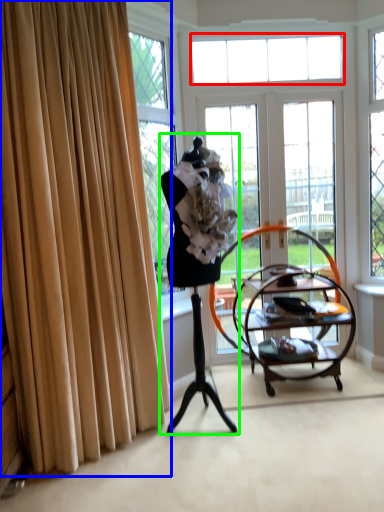
Question: Based on their relative distances, which object is nearer to window (highlighted by a red box)? Choose from curtain (highlighted by a blue box) and woman (highlighted by a green box).

Choices:
 (A) curtain
 (B) woman

Answer: (B)